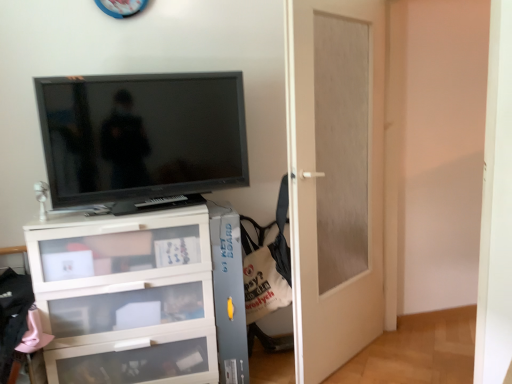
Question: Is point (196, 134) closer or farther from the camera than point (369, 114)?

Choices:
 (A) farther
 (B) closer

Answer: (B)

Question: Is matte black television at upper left wider or thinner than white matte door at center?

Choices:
 (A) wide
 (B) thin

Answer: (B)

Question: From the image's perspective, relative to white matte door at center, is matte black television at upper left above or below?

Choices:
 (A) above
 (B) below

Answer: (A)

Question: Relative to matte black television at upper left, is white matte door at center in front or behind?

Choices:
 (A) front
 (B) behind

Answer: (A)

Question: Is point (371, 135) closer or farther from the camera than point (97, 77)?

Choices:
 (A) closer
 (B) farther

Answer: (B)

Question: From a real-world perspective, is white matte door at center physically located above or below matte black television at upper left?

Choices:
 (A) below
 (B) above

Answer: (A)

Question: Considering the positions of white matte door at center and matte black television at upper left in the image, is white matte door at center wider or thinner than matte black television at upper left?

Choices:
 (A) wide
 (B) thin

Answer: (A)